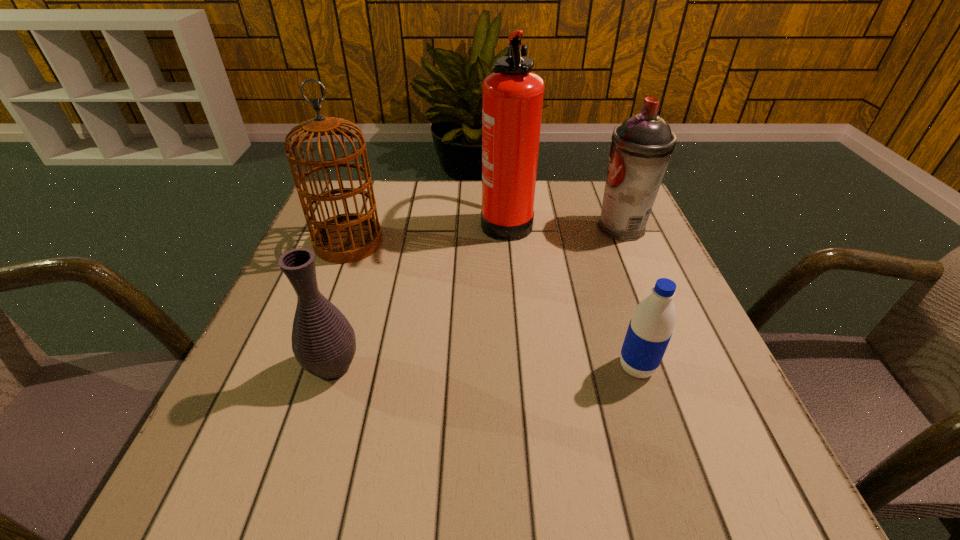
Identify the location of object present at the far left corner. The height and width of the screenshot is (540, 960). (345, 238).

Locate an element on the screen. The width and height of the screenshot is (960, 540). object situated at the far right corner is located at coordinates (641, 147).

The height and width of the screenshot is (540, 960). What are the coordinates of `free space at the far edge of the desktop` in the screenshot? It's located at (386, 225).

This screenshot has height=540, width=960. In the image, there is a desktop. What are the coordinates of `free region at the left edge` in the screenshot? It's located at (300, 396).

The image size is (960, 540). Find the location of `vacant space at the right edge`. vacant space at the right edge is located at coordinates (646, 272).

The height and width of the screenshot is (540, 960). In the image, there is a desktop. Find the location of `vacant area at the far left corner`. vacant area at the far left corner is located at coordinates (375, 195).

Locate an element on the screen. The height and width of the screenshot is (540, 960). vacant point at the near left corner is located at coordinates (277, 472).

Where is `vacant region between the shortest object and the vase`? vacant region between the shortest object and the vase is located at coordinates (485, 367).

I want to click on free space between the fourth tallest object and the tallest object, so point(420,293).

You are a GUI agent. You are given a task and a screenshot of the screen. Output one action in this format:
    pyautogui.click(x=<x>, y=<y>)
    Task: Click on the vacant space in between the birdcage and the vase
    This screenshot has width=960, height=540.
    Given the screenshot: What is the action you would take?
    pyautogui.click(x=341, y=305)